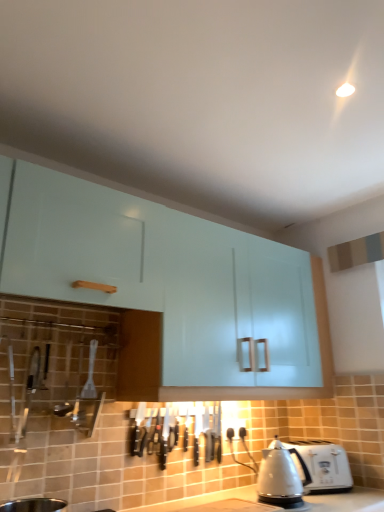
Question: Is glossy white cabinet at upper center located within satin silver kettle at lower right?

Choices:
 (A) yes
 (B) no

Answer: (B)

Question: Can you confirm if satin silver kettle at lower right is thinner than glossy white cabinet at upper center?

Choices:
 (A) yes
 (B) no

Answer: (A)

Question: Considering the relative sizes of satin silver kettle at lower right and glossy white cabinet at upper center in the image provided, is satin silver kettle at lower right wider than glossy white cabinet at upper center?

Choices:
 (A) yes
 (B) no

Answer: (B)

Question: Is satin silver kettle at lower right oriented towards glossy white cabinet at upper center?

Choices:
 (A) no
 (B) yes

Answer: (A)

Question: From a real-world perspective, is satin silver kettle at lower right on top of glossy white cabinet at upper center?

Choices:
 (A) no
 (B) yes

Answer: (A)

Question: Is point (107, 303) positioned closer to the camera than point (312, 486)?

Choices:
 (A) closer
 (B) farther

Answer: (A)

Question: Do you think glossy white cabinet at upper center is within white plastic toaster at lower right, or outside of it?

Choices:
 (A) inside
 (B) outside

Answer: (B)

Question: From the image's perspective, is glossy white cabinet at upper center positioned above or below white plastic toaster at lower right?

Choices:
 (A) above
 (B) below

Answer: (A)

Question: Considering the positions of glossy white cabinet at upper center and white plastic toaster at lower right in the image, is glossy white cabinet at upper center taller or shorter than white plastic toaster at lower right?

Choices:
 (A) tall
 (B) short

Answer: (A)

Question: Is glossy white cabinet at upper center in front of or behind satin silver kettle at lower right in the image?

Choices:
 (A) behind
 (B) front

Answer: (B)

Question: Is glossy white cabinet at upper center situated inside satin silver kettle at lower right or outside?

Choices:
 (A) inside
 (B) outside

Answer: (B)

Question: From the image's perspective, is glossy white cabinet at upper center positioned above or below satin silver kettle at lower right?

Choices:
 (A) below
 (B) above

Answer: (B)

Question: Considering the positions of point (281, 305) and point (292, 477), is point (281, 305) closer or farther from the camera than point (292, 477)?

Choices:
 (A) closer
 (B) farther

Answer: (B)

Question: From the image's perspective, is satin silver kettle at lower right positioned above or below white plastic toaster at lower right?

Choices:
 (A) below
 (B) above

Answer: (B)

Question: Is satin silver kettle at lower right in front of or behind white plastic toaster at lower right in the image?

Choices:
 (A) behind
 (B) front

Answer: (B)